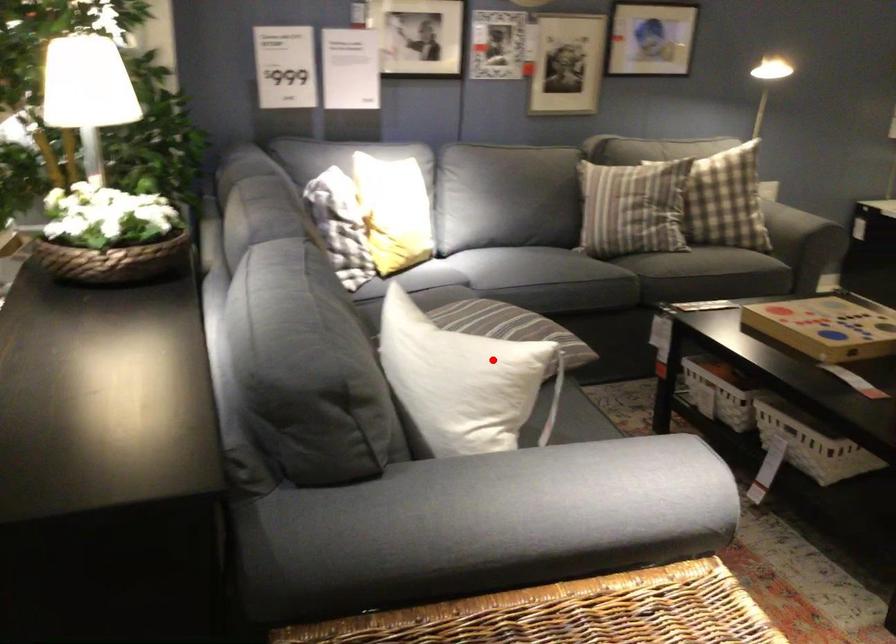
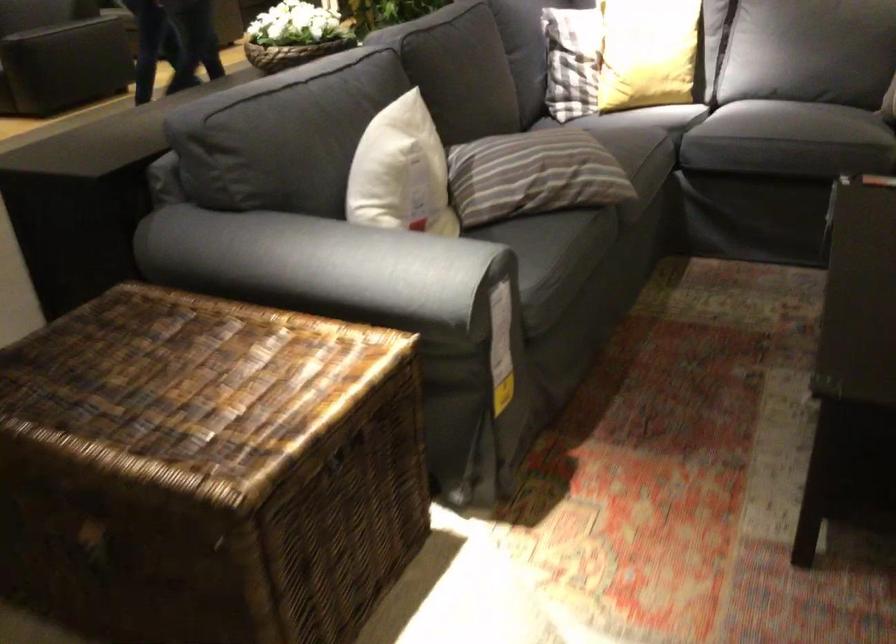
Locate, in the second image, the point that corresponds to the highlighted location in the first image.

(401, 172)